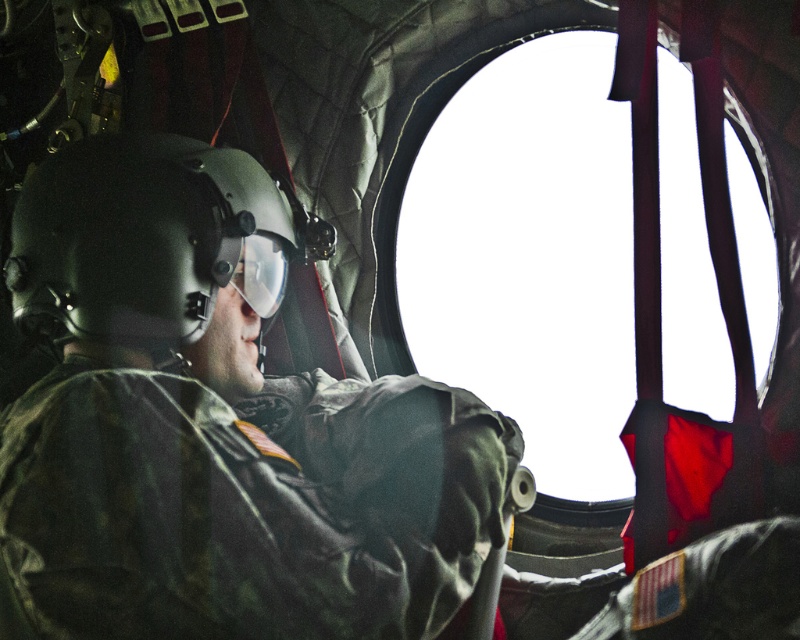
Identify the location of matte black helmet at center. This screenshot has height=640, width=800. (216, 426).

Does matte black helmet at center have a smaller size compared to transparent glass window at center?

Indeed, matte black helmet at center has a smaller size compared to transparent glass window at center.

Image resolution: width=800 pixels, height=640 pixels. I want to click on matte black helmet at center, so click(x=216, y=426).